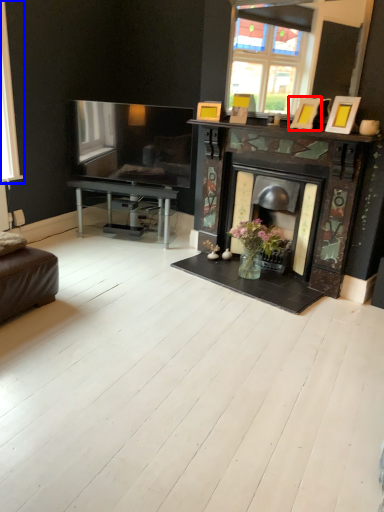
Question: Which of the following is the closest to the observer, picture frame (highlighted by a red box) or window (highlighted by a blue box)?

Choices:
 (A) picture frame
 (B) window

Answer: (A)